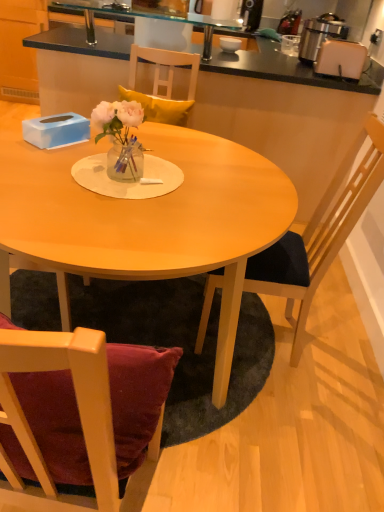
Describe the element at coordinates (148, 17) in the screenshot. I see `transparent glass sink at upper center` at that location.

What are the coordinates of `white plastic toaster at upper right` in the screenshot? It's located at (340, 59).

What is the approximate height of metallic silver toaster at upper right?

It is 10.86 inches.

You are a GUI agent. You are given a task and a screenshot of the screen. Output one action in this format:
    pyautogui.click(x=<x>, y=<y>)
    Task: Click on the metallic silver toaster at upper right
    
    Given the screenshot: What is the action you would take?
    pos(319,35)

Locate an element on the screen. The image size is (384, 512). clear glass vase at center is located at coordinates (120, 138).

Visually, is transparent glass sink at upper center positioned to the left or to the right of black laminate cabinet at upper left?

Clearly, transparent glass sink at upper center is on the right of black laminate cabinet at upper left in the image.

Measure the distance from transparent glass sink at upper center to black laminate cabinet at upper left.

transparent glass sink at upper center and black laminate cabinet at upper left are 31.64 inches apart from each other.

Is transparent glass sink at upper center looking in the opposite direction of black laminate cabinet at upper left?

No.

Is black laminate cabinet at upper left inside transparent glass sink at upper center?

No, black laminate cabinet at upper left is not a part of transparent glass sink at upper center.

From a real-world perspective, between matte wood table at center and clear glass vase at center, who is vertically higher?

clear glass vase at center is physically above.

Is point (238, 253) farther from camera compared to point (117, 109)?

No, (238, 253) is in front of (117, 109).

Which object is further away from the camera, matte wood table at center or clear glass vase at center?

Positioned behind is clear glass vase at center.

Does point (118, 111) lie in front of point (331, 217)?

That is True.

From the picture: How different are the orientations of clear glass vase at center and wooden chair at right in degrees?

The angular difference between clear glass vase at center and wooden chair at right is 96.2 degrees.

Find the location of `chair that appears on the right of clear glass vase at center`. chair that appears on the right of clear glass vase at center is located at coordinates (319, 236).

Looking at the image, does metallic silver toaster at upper right seem bigger or smaller compared to clear glass vase at center?

Clearly, metallic silver toaster at upper right is larger in size than clear glass vase at center.

Is metallic silver toaster at upper right facing towards clear glass vase at center?

No.

Considering the relative sizes of metallic silver toaster at upper right and clear glass vase at center in the image provided, is metallic silver toaster at upper right wider than clear glass vase at center?

Correct, the width of metallic silver toaster at upper right exceeds that of clear glass vase at center.

This screenshot has width=384, height=512. In order to click on kitchen appliance that is above the clear glass vase at center (from the image's perspective) in this screenshot , I will do `click(319, 35)`.

From the image's perspective, which object appears higher, metallic silver toaster at upper right or black laminate cabinet at upper left?

black laminate cabinet at upper left is shown above in the image.

Does metallic silver toaster at upper right have a larger size compared to black laminate cabinet at upper left?

Actually, metallic silver toaster at upper right might be smaller than black laminate cabinet at upper left.

Can we say metallic silver toaster at upper right lies outside black laminate cabinet at upper left?

Yes, metallic silver toaster at upper right is not within black laminate cabinet at upper left.

I want to click on kitchen appliance above the black laminate cabinet at upper left (from a real-world perspective), so click(x=319, y=35).

Which object is positioned more to the right, matte wood table at center or white glossy bowl at upper center?

white glossy bowl at upper center.

From a real-world perspective, is matte wood table at center below white glossy bowl at upper center?

Correct, in the physical world, matte wood table at center is lower than white glossy bowl at upper center.

Is matte wood table at center further to camera compared to white glossy bowl at upper center?

No.

Can we say black laminate cabinet at upper left lies outside clear glass vase at center?

Indeed, black laminate cabinet at upper left is completely outside clear glass vase at center.

From a real-world perspective, which object stands above the other?

clear glass vase at center is physically above.

Is black laminate cabinet at upper left taller than clear glass vase at center?

Yes, black laminate cabinet at upper left is taller than clear glass vase at center.

Based on the photo, is black laminate cabinet at upper left smaller than clear glass vase at center?

No, black laminate cabinet at upper left is not smaller than clear glass vase at center.

There is a black laminate cabinet at upper left. Where is `sink above it (from a real-world perspective)`? Image resolution: width=384 pixels, height=512 pixels. sink above it (from a real-world perspective) is located at coordinates [148, 17].

I want to click on desk to the left of clear glass vase at center, so click(x=145, y=219).

Considering their positions, is white glossy bowl at upper center positioned closer to wooden table at center than black laminate cabinet at upper left?

The object closer to wooden table at center is white glossy bowl at upper center.

Looking at this image, considering their positions, is white glossy bowl at upper center positioned further to white plastic toaster at upper right than matte wood table at center?

matte wood table at center is positioned further to the anchor white plastic toaster at upper right.

Looking at the image, which one is located closer to transparent glass sink at upper center, white glossy bowl at upper center or clear glass vase at center?

white glossy bowl at upper center lies closer to transparent glass sink at upper center than the other object.

From the image, which object appears to be farther from wooden chair at right, black laminate cabinet at upper left or wooden table at center?

black laminate cabinet at upper left.

Which object lies further to the anchor point metallic silver toaster at upper right, clear glass vase at center or white plastic toaster at upper right?

The object further to metallic silver toaster at upper right is clear glass vase at center.

Looking at the image, which one is located further to metallic silver toaster at upper right, white plastic toaster at upper right or matte wood table at center?

Among the two, matte wood table at center is located further to metallic silver toaster at upper right.

Which object lies nearer to the anchor point white plastic toaster at upper right, metallic silver toaster at upper right or wooden table at center?

metallic silver toaster at upper right lies closer to white plastic toaster at upper right than the other object.

Looking at this image, estimate the real-world distances between objects in this image. Which object is further from metallic silver toaster at upper right, matte wood table at center or wooden chair at right?

matte wood table at center is further to metallic silver toaster at upper right.

Locate an element on the screen. coffee cup between black laminate cabinet at upper left and white plastic toaster at upper right from left to right is located at coordinates (230, 44).

Find the location of a particular element. toaster situated between white glossy bowl at upper center and metallic silver toaster at upper right from left to right is located at coordinates (340, 59).

Where is `sink positioned between wooden chair at right and white glossy bowl at upper center from near to far`? sink positioned between wooden chair at right and white glossy bowl at upper center from near to far is located at coordinates (148, 17).

You are a GUI agent. You are given a task and a screenshot of the screen. Output one action in this format:
    pyautogui.click(x=<x>, y=<y>)
    Task: Click on the floral arrangement between matte wood table at center and metallic silver toaster at upper right from front to back
    
    Given the screenshot: What is the action you would take?
    pyautogui.click(x=120, y=138)